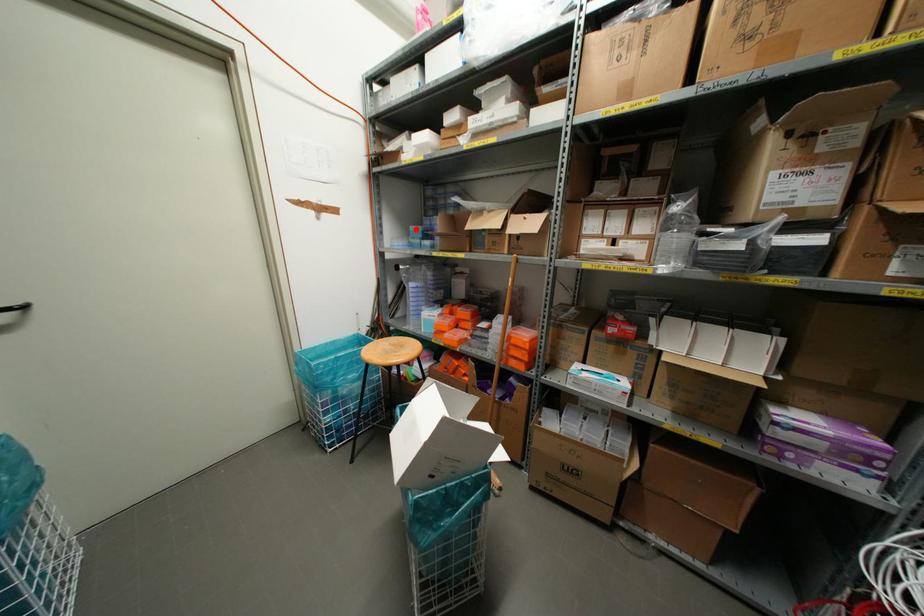
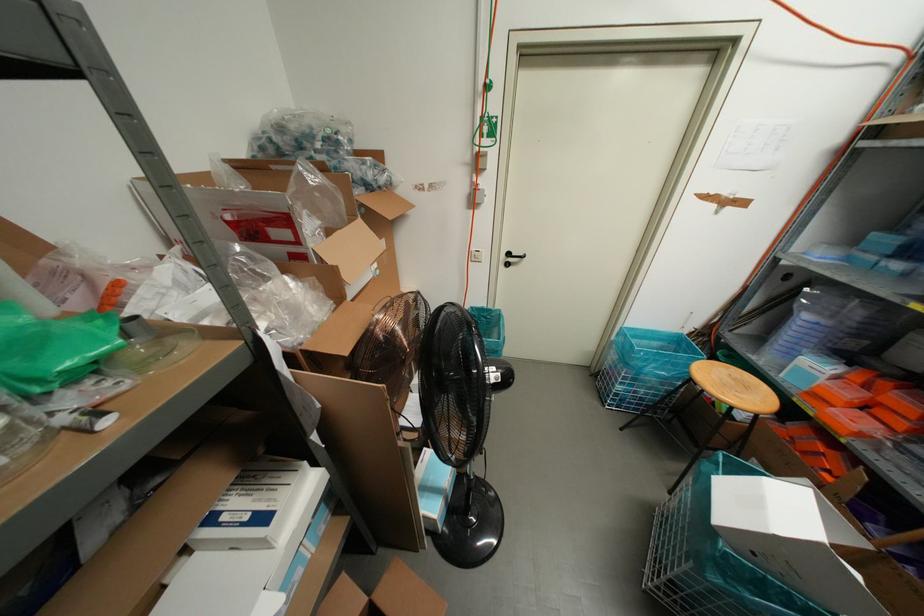
Question: A red point is marked in image1. In image2, is the corresponding 3D point closer to the camera or farther? Reply with the corresponding letter.

Choices:
 (A) The corresponding 3D point is closer.
 (B) The corresponding 3D point is farther.

Answer: (B)